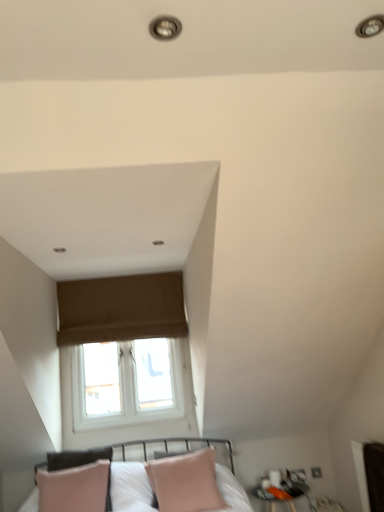
Question: From the image's perspective, would you say brown fabric window at upper center is shown under pink leather pillow at lower center?

Choices:
 (A) yes
 (B) no

Answer: (B)

Question: Is brown fabric window at upper center facing away from pink leather pillow at lower center?

Choices:
 (A) no
 (B) yes

Answer: (A)

Question: Considering the relative positions of brown fabric window at upper center and pink leather pillow at lower center in the image provided, is brown fabric window at upper center in front of pink leather pillow at lower center?

Choices:
 (A) yes
 (B) no

Answer: (B)

Question: Does brown fabric window at upper center have a greater width compared to pink leather pillow at lower center?

Choices:
 (A) yes
 (B) no

Answer: (B)

Question: Is brown fabric window at upper center smaller than pink leather pillow at lower center?

Choices:
 (A) yes
 (B) no

Answer: (A)

Question: Is brown fabric window at upper center far away from pink leather pillow at lower center?

Choices:
 (A) yes
 (B) no

Answer: (A)

Question: Can you confirm if brown fabric window at upper center is thinner than matte black side table at lower right?

Choices:
 (A) yes
 (B) no

Answer: (A)

Question: From the image's perspective, is brown fabric window at upper center on top of matte black side table at lower right?

Choices:
 (A) no
 (B) yes

Answer: (B)

Question: Does brown fabric window at upper center appear on the left side of matte black side table at lower right?

Choices:
 (A) no
 (B) yes

Answer: (B)

Question: Can you see brown fabric window at upper center touching matte black side table at lower right?

Choices:
 (A) no
 (B) yes

Answer: (A)

Question: Can you confirm if brown fabric window at upper center is smaller than matte black side table at lower right?

Choices:
 (A) yes
 (B) no

Answer: (B)

Question: Is the depth of brown fabric window at upper center less than that of matte black side table at lower right?

Choices:
 (A) yes
 (B) no

Answer: (B)

Question: From the image's perspective, is matte black side table at lower right under pink leather pillow at lower center?

Choices:
 (A) yes
 (B) no

Answer: (A)